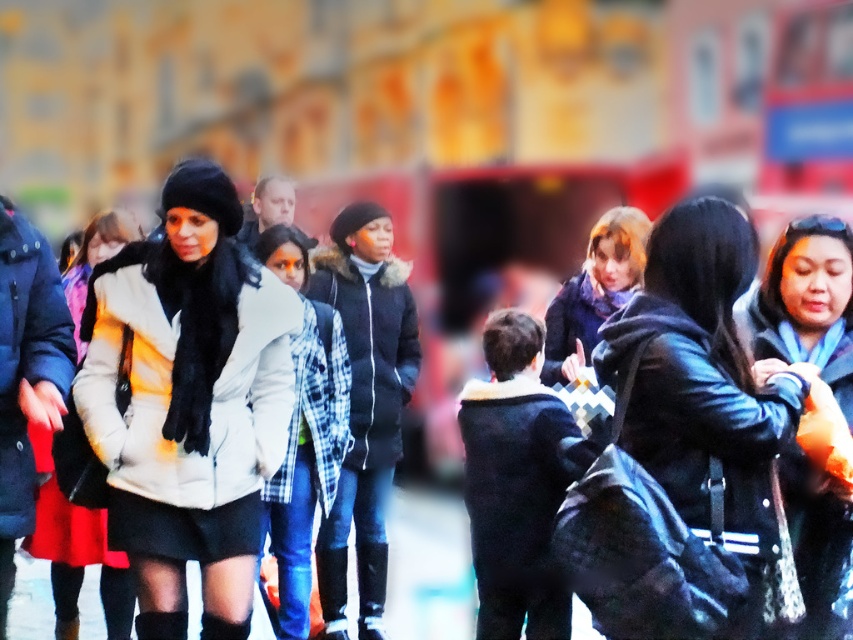
You are a fashion designer observing the crowd in the urban scene. You notice two jackets in the crowd. Which jacket is larger in size between the matte black jacket at center and the leather jacket at right?

The matte black jacket at center is bigger than the leather jacket at right.

You are a photographer trying to capture a clear shot of both the leather jacket at right and the leather boot at center. Since you want both subjects in focus, you need to adjust your camera to ensure they are both within the depth of field. Based on their positions, which object should you focus on to achieve this?

You should focus on the leather jacket at right because it is closer to the camera than the leather boot at center, so focusing on the closer object will ensure both are within the depth of field.